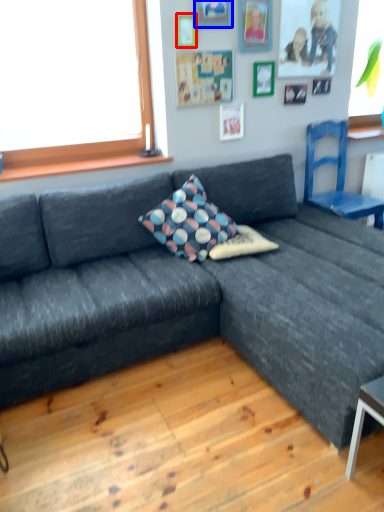
Question: Which point is closer to the camera, picture frame (highlighted by a red box) or picture frame (highlighted by a blue box)?

Choices:
 (A) picture frame
 (B) picture frame

Answer: (B)